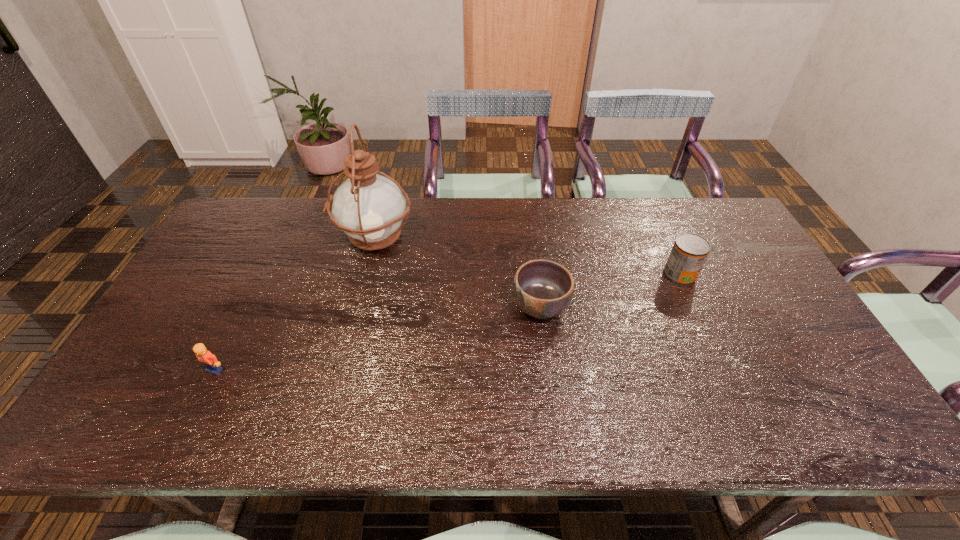
Identify the location of empty space that is in between the can and the oil lamp. This screenshot has height=540, width=960. (527, 256).

At what (x,y) coordinates should I click in order to perform the action: click on free space between the can and the nearest object. Please return your answer as a coordinate pair (x, y). Looking at the image, I should click on (447, 322).

Find the location of a particular element. free space between the can and the Lego is located at coordinates (447, 322).

Locate an element on the screen. Image resolution: width=960 pixels, height=540 pixels. vacant region between the leftmost object and the third object from right to left is located at coordinates (295, 303).

Identify the location of vacant area between the bowl and the second object from left to right. Image resolution: width=960 pixels, height=540 pixels. (457, 272).

I want to click on free area in between the can and the second object from left to right, so click(527, 256).

Locate an element on the screen. vacant area that lies between the can and the leftmost object is located at coordinates (447, 322).

This screenshot has width=960, height=540. What are the coordinates of `vacant region between the third object from right to left and the Lego` in the screenshot? It's located at (295, 303).

Select which object appears as the third closest to the can. Please provide its 2D coordinates. Your answer should be formatted as a tuple, i.e. [(x, y)], where the tuple contains the x and y coordinates of a point satisfying the conditions above.

[(208, 359)]

At what (x,y) coordinates should I click in order to perform the action: click on object identified as the third closest to the Lego. Please return your answer as a coordinate pair (x, y). Looking at the image, I should click on (689, 252).